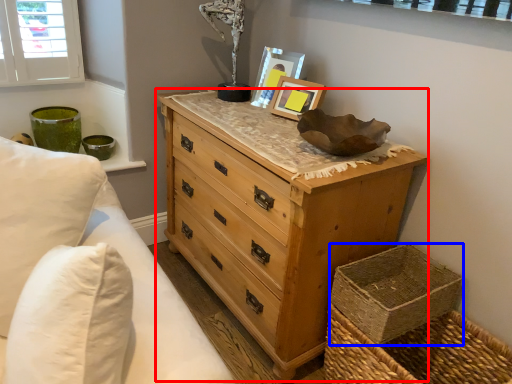
Question: Which object appears closest to the camera in this image, chest of drawers (highlighted by a red box) or basket container (highlighted by a blue box)?

Choices:
 (A) chest of drawers
 (B) basket container

Answer: (A)